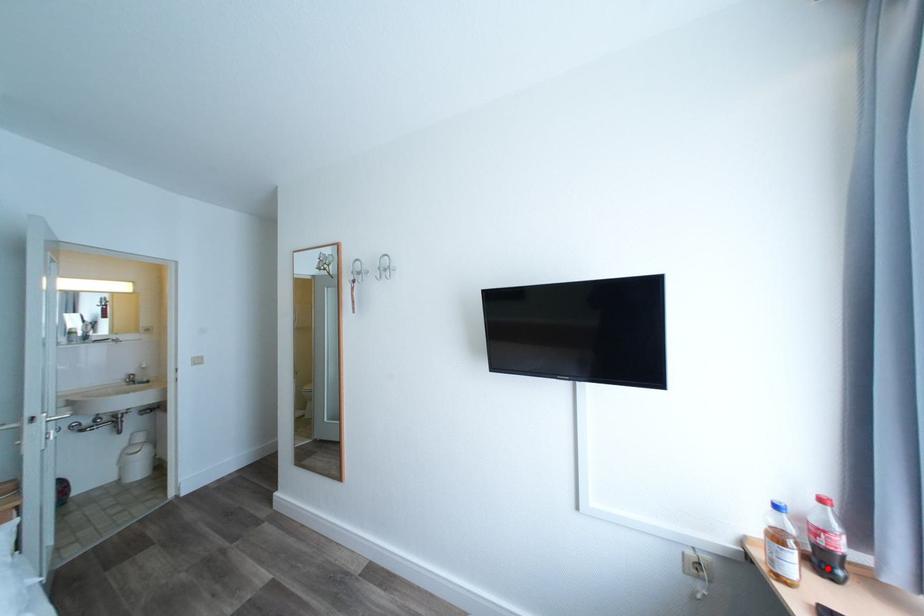
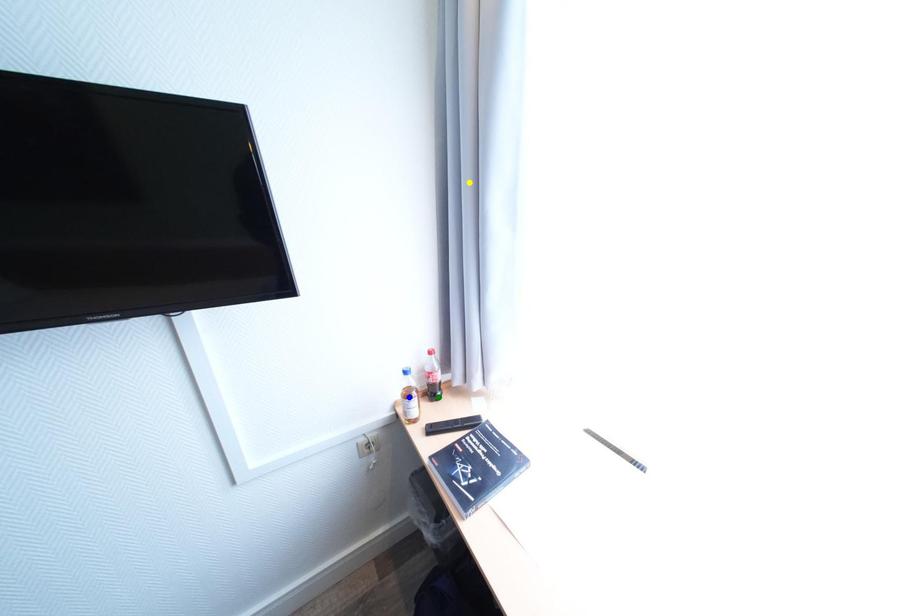
Question: I am providing you with two images of the same scene from different viewpoints. A red point is marked on the first image. You are given multiple points on the second image. Which point in image 2 represents the same 3d spot as the red point in image 1?

Choices:
 (A) green point
 (B) yellow point
 (C) blue point

Answer: (A)